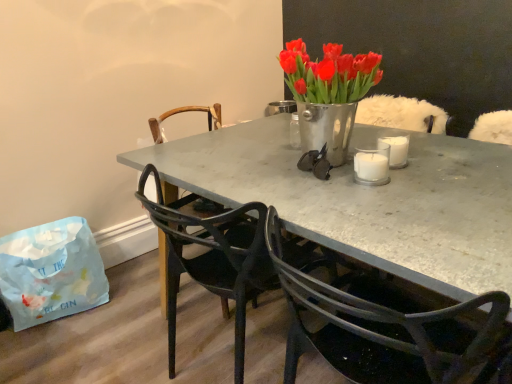
Find the location of `vacant area located to the right-hand side of white glass candle at center`. vacant area located to the right-hand side of white glass candle at center is located at coordinates (431, 170).